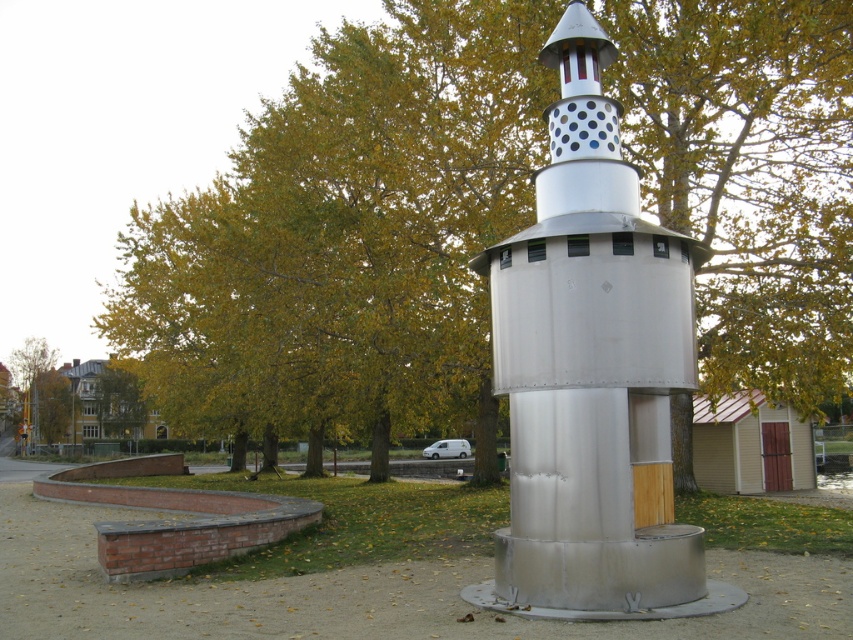
Who is lower down, green leafy tree at center or metallic silver tower at center?

metallic silver tower at center is lower down.

In order to click on green leafy tree at center in this screenshot , I will do `click(347, 230)`.

Between green leafy tree at center and green leafy tree at upper left, which one is positioned higher?

green leafy tree at center is higher up.

Between green leafy tree at center and green leafy tree at upper left, which one appears on the left side from the viewer's perspective?

green leafy tree at upper left

Find the location of `green leafy tree at center`. green leafy tree at center is located at coordinates (347, 230).

Does metallic silver tower at center lie behind green leafy tree at upper left?

No, metallic silver tower at center is in front of green leafy tree at upper left.

Which is behind, point (619, 356) or point (97, 396)?

Positioned behind is point (97, 396).

Image resolution: width=853 pixels, height=640 pixels. I want to click on metallic silver tower at center, so click(590, 365).